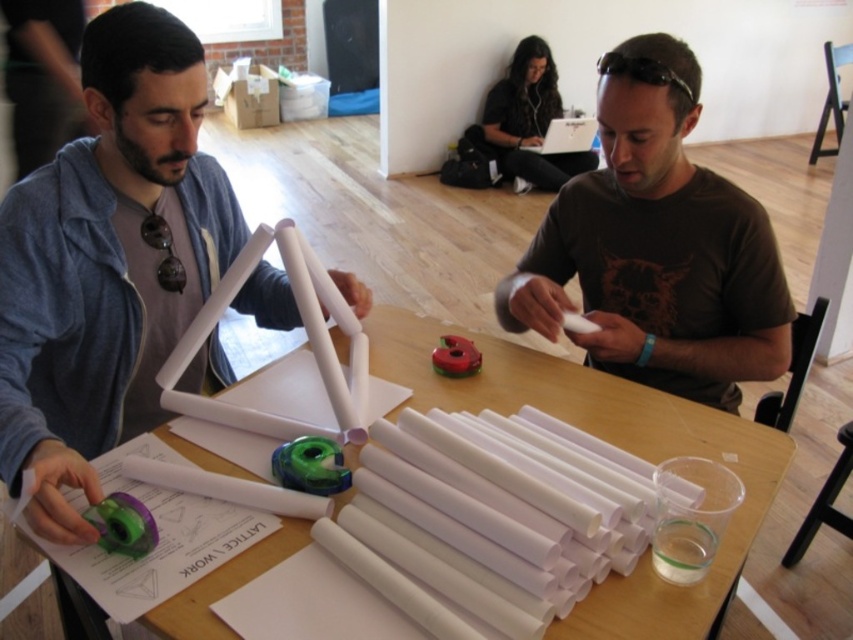
Between point (33, 460) and point (427, 499), which one is positioned behind?

Positioned behind is point (33, 460).

Is matte white triangle at upper center behind white matte tubes at center?

Yes, matte white triangle at upper center is behind white matte tubes at center.

Is point (131, 131) less distant than point (479, 572)?

No.

The image size is (853, 640). In order to click on matte white triangle at upper center in this screenshot , I will do `click(107, 262)`.

Which is more to the left, white matte tubes at center or white paper at center?

white paper at center

Identify the location of white matte tubes at center. This screenshot has height=640, width=853. (488, 516).

Is the position of brown matte shirt at center more distant than that of white matte tubes at center?

Yes, brown matte shirt at center is further from the viewer.

Which is behind, point (752, 376) or point (538, 588)?

Positioned behind is point (752, 376).

Locate an element on the screen. This screenshot has height=640, width=853. brown matte shirt at center is located at coordinates (657, 246).